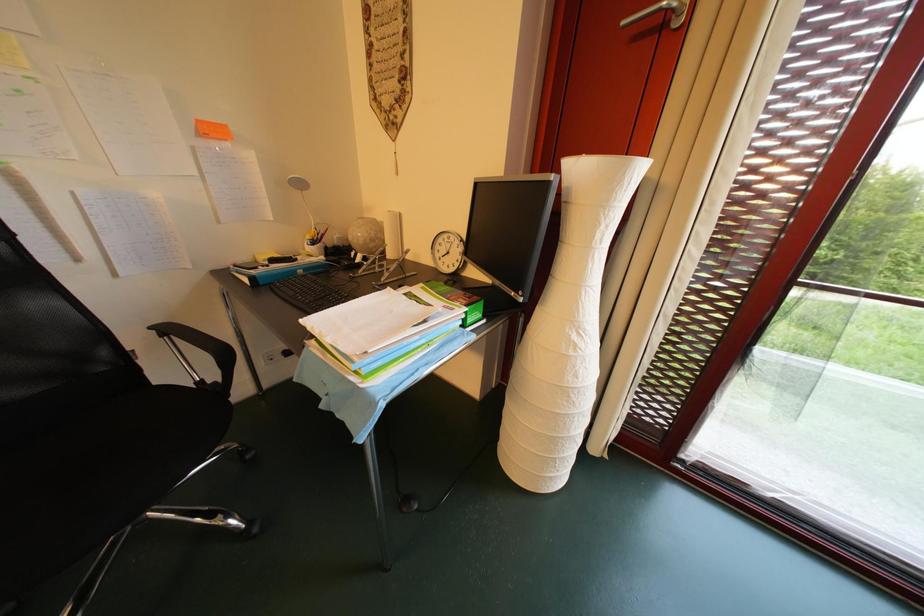
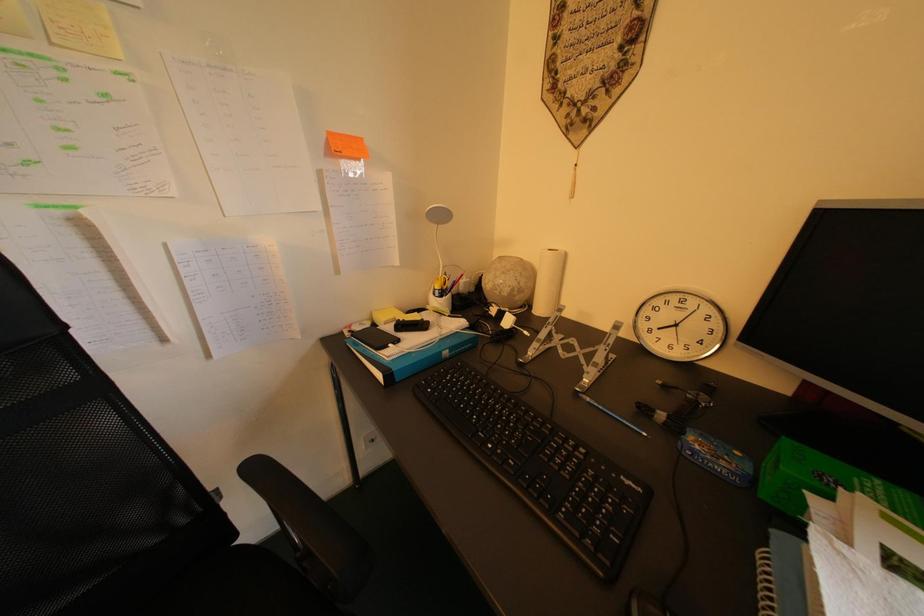
In a continuous first-person perspective shot, in which direction is the camera moving?

The movement direction of the cameraman is left, forward.